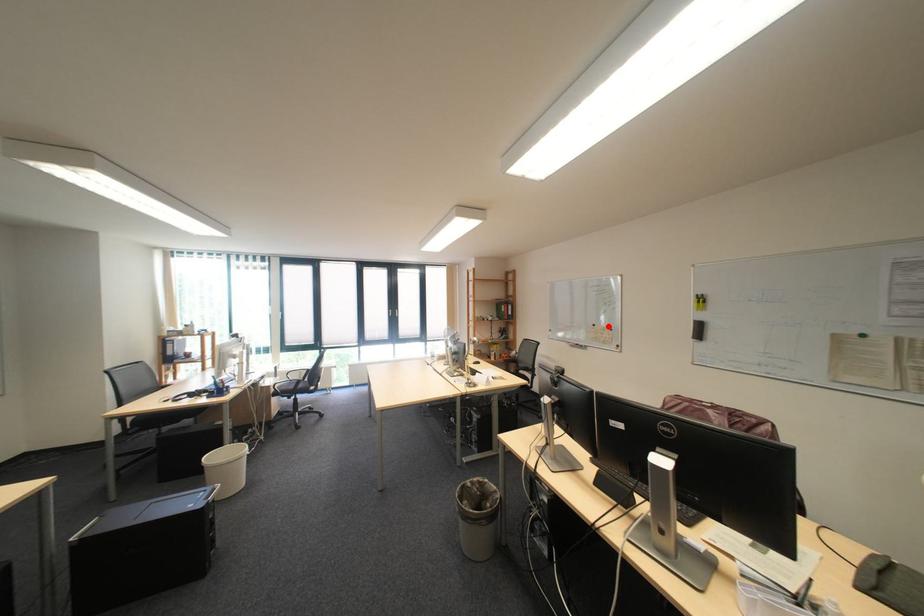
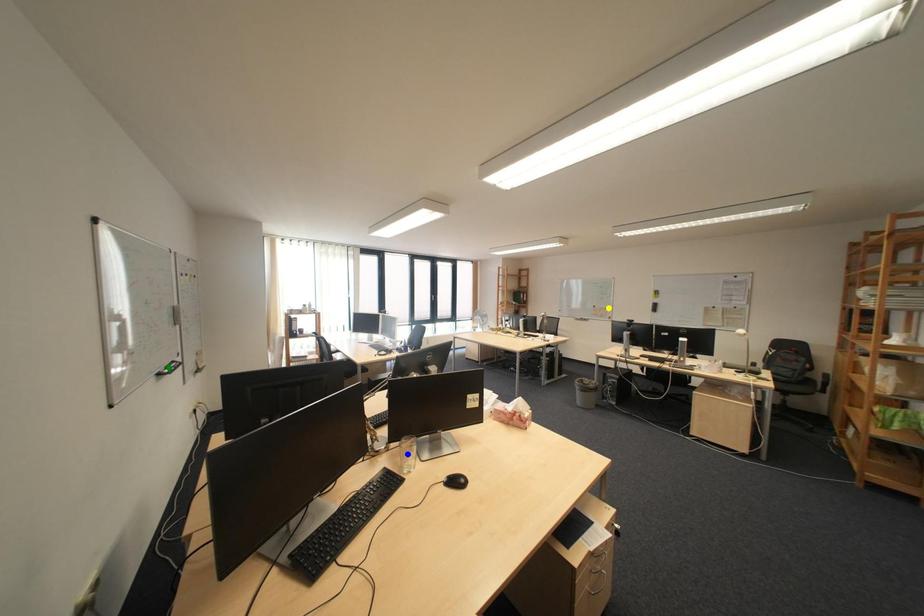
Question: I am providing you with two images of the same scene from different viewpoints. A red point is marked on the first image. You are given multiple points on the second image. Which spot in image 2 lines up with the point in image 1?

Choices:
 (A) green point
 (B) blue point
 (C) yellow point

Answer: (C)